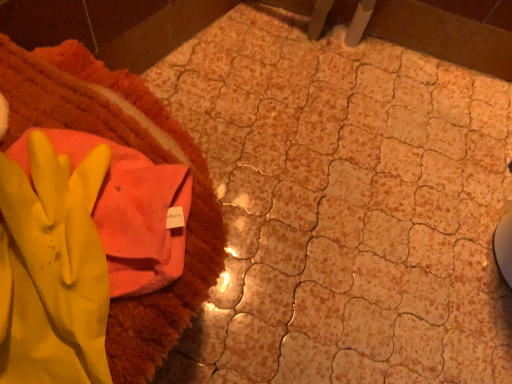
What is the approximate width of orange terry cloth towel at upper left?

It is 41.37 centimeters.

Describe the element at coordinates (137, 149) in the screenshot. Image resolution: width=512 pixels, height=384 pixels. I see `orange terry cloth towel at upper left` at that location.

Find the location of a particular element. The height and width of the screenshot is (384, 512). orange terry cloth towel at upper left is located at coordinates (137, 149).

From the picture: Measure the distance between point (96,326) and camera.

A distance of 12.64 inches exists between point (96,326) and camera.

Identify the location of yellow rubber glove at left. The image size is (512, 384). (52, 269).

This screenshot has height=384, width=512. What do you see at coordinates (52, 269) in the screenshot?
I see `yellow rubber glove at left` at bounding box center [52, 269].

This screenshot has width=512, height=384. I want to click on orange terry cloth towel at upper left, so click(137, 149).

Which object is positioned more to the right, orange terry cloth towel at upper left or yellow rubber glove at left?

From the viewer's perspective, yellow rubber glove at left appears more on the right side.

Relative to yellow rubber glove at left, is orange terry cloth towel at upper left in front or behind?

Visually, orange terry cloth towel at upper left is located behind yellow rubber glove at left.

Does point (134, 318) appear closer or farther from the camera than point (104, 273)?

Point (134, 318) is positioned farther from the camera compared to point (104, 273).

From the image's perspective, relative to yellow rubber glove at left, is orange terry cloth towel at upper left above or below?

Based on their image positions, orange terry cloth towel at upper left is located above yellow rubber glove at left.

From a real-world perspective, is orange terry cloth towel at upper left positioned over yellow rubber glove at left based on gravity?

No.

Considering the relative sizes of orange terry cloth towel at upper left and yellow rubber glove at left in the image provided, is orange terry cloth towel at upper left wider than yellow rubber glove at left?

Indeed, orange terry cloth towel at upper left has a greater width compared to yellow rubber glove at left.

Is orange terry cloth towel at upper left shorter than yellow rubber glove at left?

In fact, orange terry cloth towel at upper left may be taller than yellow rubber glove at left.

Can you confirm if orange terry cloth towel at upper left is bigger than yellow rubber glove at left?

Indeed, orange terry cloth towel at upper left has a larger size compared to yellow rubber glove at left.

Is orange terry cloth towel at upper left outside of yellow rubber glove at left?

Yes.

Is orange terry cloth towel at upper left beside yellow rubber glove at left?

They are not placed beside each other.

Could you tell me if orange terry cloth towel at upper left is turned towards yellow rubber glove at left?

No, orange terry cloth towel at upper left is not turned towards yellow rubber glove at left.

Where is `glove on the right of orange terry cloth towel at upper left`? The image size is (512, 384). glove on the right of orange terry cloth towel at upper left is located at coordinates (52, 269).

Considering the relative positions of yellow rubber glove at left and orange terry cloth towel at upper left in the image provided, is yellow rubber glove at left to the left or to the right of orange terry cloth towel at upper left?

yellow rubber glove at left is positioned on orange terry cloth towel at upper left's right side.

Which is in front, yellow rubber glove at left or orange terry cloth towel at upper left?

yellow rubber glove at left is more forward.

Which is further, (22, 227) or (116, 116)?

The point (116, 116) is behind.

From the image's perspective, relative to orange terry cloth towel at upper left, is yellow rubber glove at left above or below?

Clearly, from the image's perspective, yellow rubber glove at left is below orange terry cloth towel at upper left.

From a real-world perspective, which object stands above the other?

From a 3D spatial view, yellow rubber glove at left is above.

Considering the sizes of objects yellow rubber glove at left and orange terry cloth towel at upper left in the image provided, who is wider, yellow rubber glove at left or orange terry cloth towel at upper left?

orange terry cloth towel at upper left is wider.

Considering the sizes of yellow rubber glove at left and orange terry cloth towel at upper left in the image, is yellow rubber glove at left taller or shorter than orange terry cloth towel at upper left?

Clearly, yellow rubber glove at left is shorter compared to orange terry cloth towel at upper left.

Which of these two, yellow rubber glove at left or orange terry cloth towel at upper left, is smaller?

yellow rubber glove at left.

Is yellow rubber glove at left inside or outside of orange terry cloth towel at upper left?

yellow rubber glove at left can be found inside orange terry cloth towel at upper left.

Are yellow rubber glove at left and orange terry cloth towel at upper left beside each other?

No, yellow rubber glove at left is not in contact with orange terry cloth towel at upper left.

Is yellow rubber glove at left turned away from orange terry cloth towel at upper left?

Correct, yellow rubber glove at left is looking away from orange terry cloth towel at upper left.

How many degrees apart are the facing directions of yellow rubber glove at left and orange terry cloth towel at upper left?

The angular difference between yellow rubber glove at left and orange terry cloth towel at upper left is 47.5 degrees.

This screenshot has width=512, height=384. I want to click on towel behind the yellow rubber glove at left, so click(x=137, y=149).

Locate an element on the screen. towel that is behind the yellow rubber glove at left is located at coordinates (137, 149).

Identify the location of glove below the orange terry cloth towel at upper left (from the image's perspective). (52, 269).